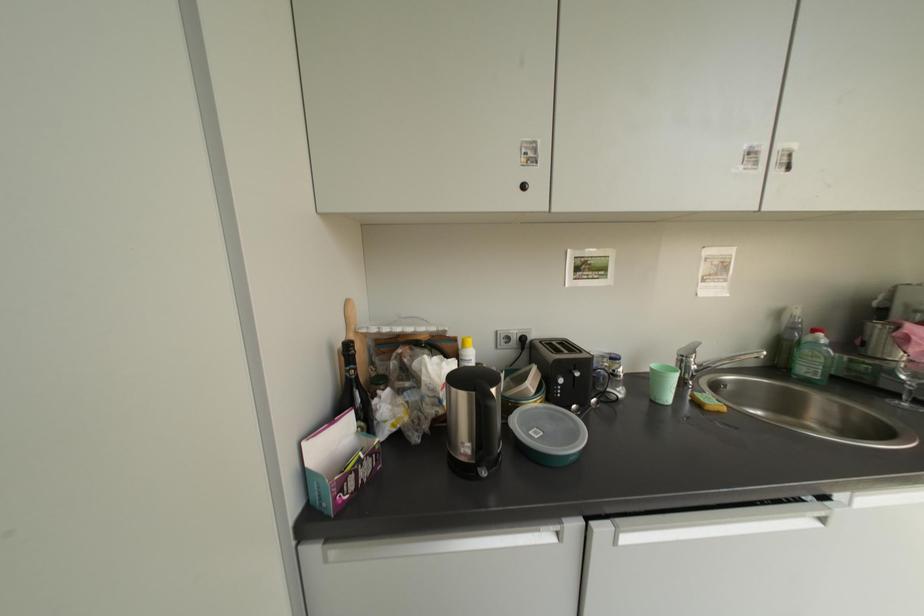
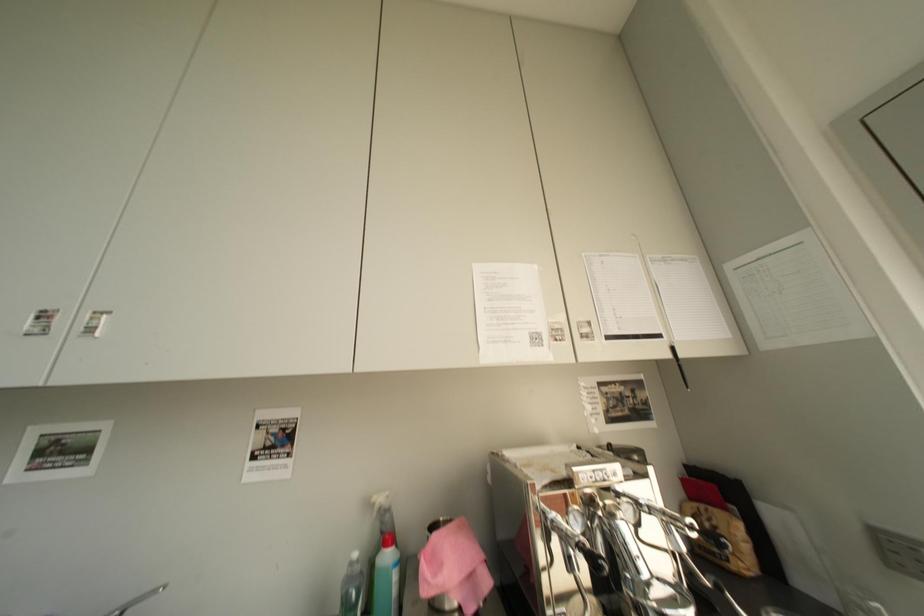
Question: Which direction would the cameraman need to move to produce the second image? Reply with the corresponding letter.

Choices:
 (A) Left
 (B) Right
 (C) Forward
 (D) Backward

Answer: (B)